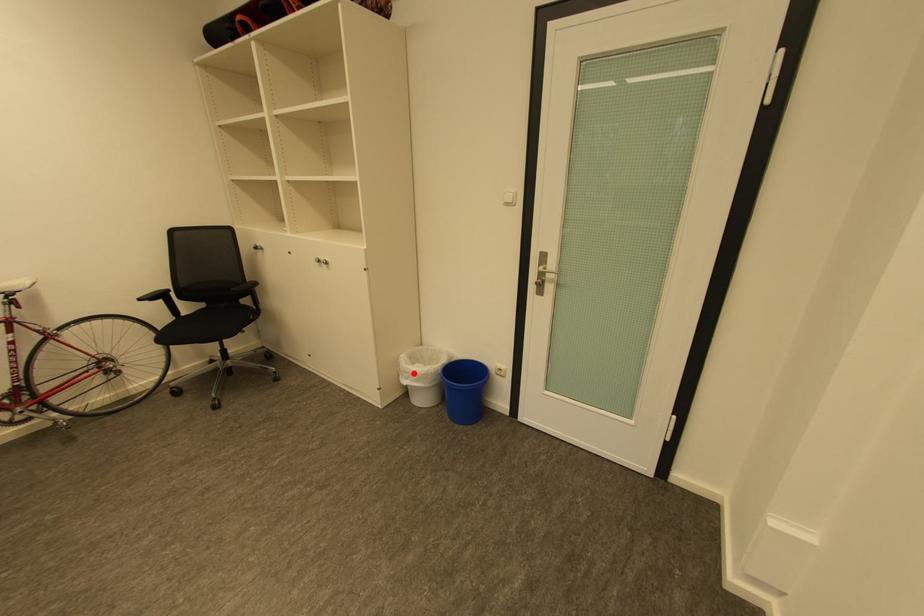
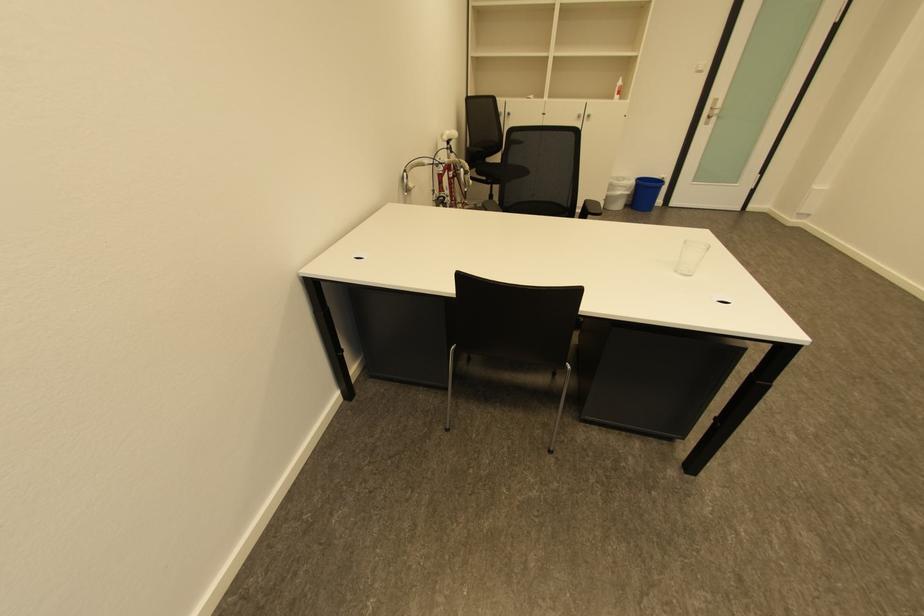
Where in the second image is the point corresponding to the highlighted location from the first image?

(626, 188)